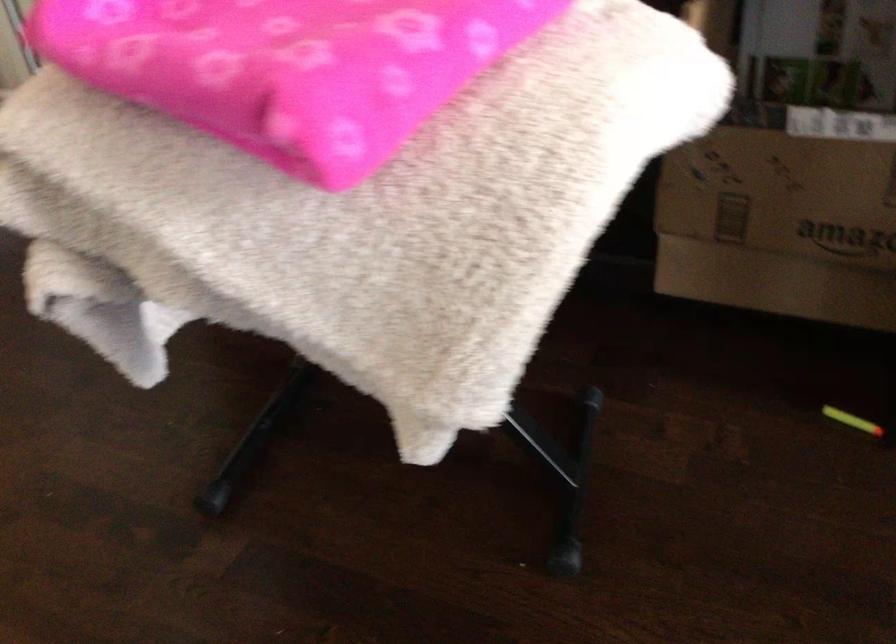
Find where to lift the cardboard amazon box. Please return your answer as a coordinate pair (x, y).

(780, 225)